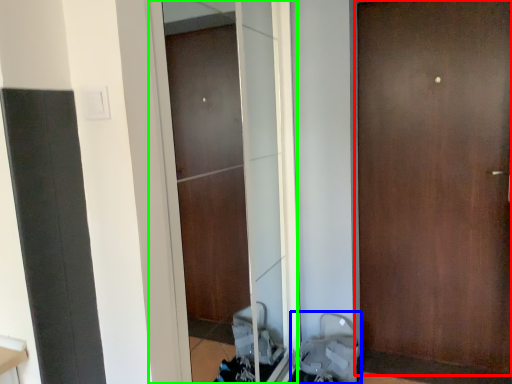
Question: Estimate the real-world distances between objects in this image. Which object is closer to door (highlighted by a red box), baby carriage (highlighted by a blue box) or screen door (highlighted by a green box)?

Choices:
 (A) baby carriage
 (B) screen door

Answer: (B)